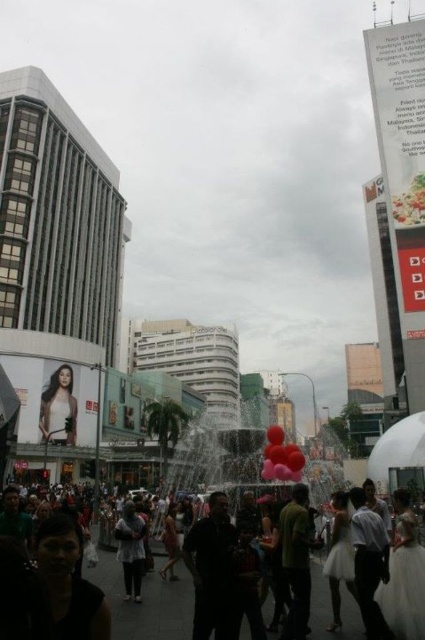
You are a photographer positioned at the point marked by coordinates point (144,602). You want to capture the crowd at center in your shot. Is the crowd at center visible from your current position?

The point marked by coordinates point (144,602) marks matte black crowd at center, so yes, the crowd at center is visible from your current position.

You are a photographer trying to capture a photo of the green matte shirt at center without including the matte black crowd at center in the frame. Given their sizes, is this possible?

The matte black crowd at center is wider than the green matte shirt at center, so it might be challenging to exclude the crowd from the photo if they are positioned closely together. Adjusting the camera angle or zoom could help isolate the shirt.

Consider the image. You are a photographer trying to capture a shot of the dark gray sweater at center and the rubber balloons at center. If you want to ensure both objects are in focus, which one should you adjust your camera focus closer to?

The dark gray sweater at center is narrower than the rubber balloons at center, so you should focus closer to the rubber balloons at center to ensure both are in focus.